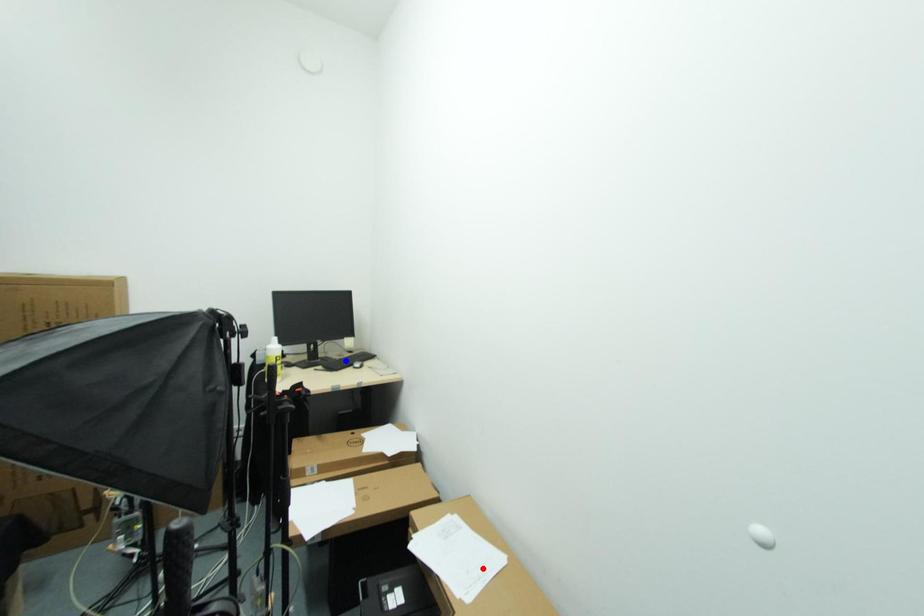
Question: Two points are marked on the image. Which point is closer to the camera?

Choices:
 (A) Blue point is closer.
 (B) Red point is closer.

Answer: (B)